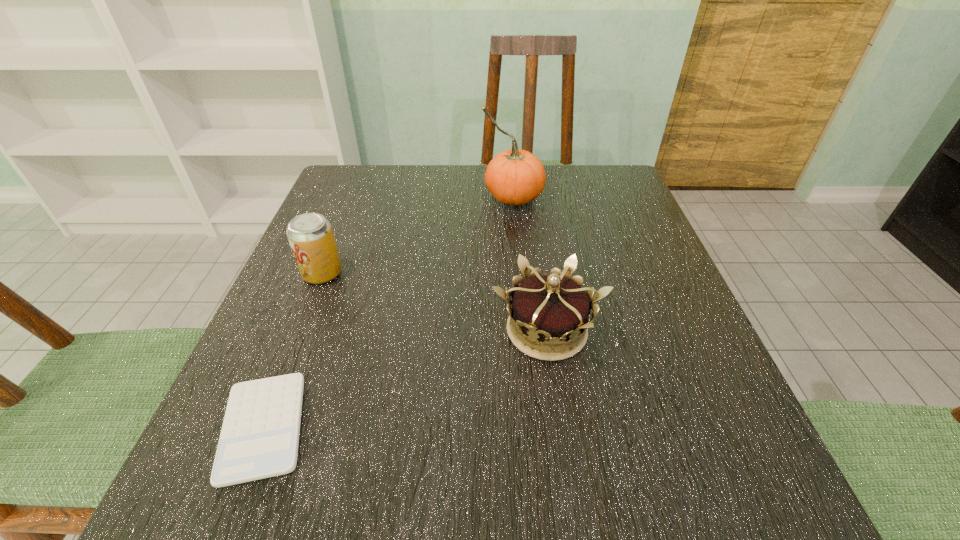
Where is `object at the far edge`? The height and width of the screenshot is (540, 960). object at the far edge is located at coordinates (515, 177).

Locate an element on the screen. The height and width of the screenshot is (540, 960). object present at the near edge is located at coordinates (259, 439).

Find the location of a particular element. This screenshot has height=540, width=960. pop (soda) present at the left edge is located at coordinates (310, 235).

This screenshot has height=540, width=960. Find the location of `calculator at the left edge`. calculator at the left edge is located at coordinates (259, 439).

The image size is (960, 540). I want to click on object that is at the right edge, so click(552, 308).

You are a GUI agent. You are given a task and a screenshot of the screen. Output one action in this format:
    pyautogui.click(x=<x>, y=<y>)
    Task: Click on the object located at the near left corner
    This screenshot has height=540, width=960.
    Given the screenshot: What is the action you would take?
    pyautogui.click(x=259, y=439)

Find the location of a particular element. free space at the far edge is located at coordinates (465, 202).

You are a GUI agent. You are given a task and a screenshot of the screen. Output one action in this format:
    pyautogui.click(x=<x>, y=<y>)
    Task: Click on the vacant space at the near edge of the desktop
    The height and width of the screenshot is (540, 960).
    Given the screenshot: What is the action you would take?
    pyautogui.click(x=420, y=524)

Image resolution: width=960 pixels, height=540 pixels. In the image, there is a desktop. Identify the location of vacant space at the left edge. (362, 285).

I want to click on free space at the right edge of the desktop, so click(x=660, y=270).